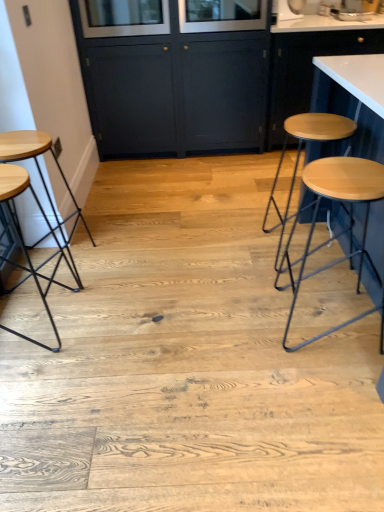
Question: Does clear glass window screen at upper center, the 2th window screen positioned from the left, have a lesser width compared to wooden seat at left, which is the 1th stool from left to right?

Choices:
 (A) yes
 (B) no

Answer: (B)

Question: Is clear glass window screen at upper center, the 2th window screen positioned from the left, at the left side of wooden seat at left, which is the 1th stool from left to right?

Choices:
 (A) no
 (B) yes

Answer: (A)

Question: Could wooden seat at left, placed as the second stool when sorted from right to left, be considered to be inside clear glass window screen at upper center, the 2th window screen positioned from the left?

Choices:
 (A) yes
 (B) no

Answer: (B)

Question: Can you confirm if clear glass window screen at upper center, the 1th window screen positioned from the right, is smaller than wooden seat at left, which is the 1th stool from left to right?

Choices:
 (A) yes
 (B) no

Answer: (A)

Question: From a real-world perspective, is clear glass window screen at upper center, the 2th window screen positioned from the left, under wooden seat at left, placed as the second stool when sorted from right to left?

Choices:
 (A) yes
 (B) no

Answer: (B)

Question: Considering the positions of wooden stool at right, which is the first stool from right to left, and clear glass window screen at upper center, the 1th window screen positioned from the right, in the image, is wooden stool at right, which is the first stool from right to left, taller or shorter than clear glass window screen at upper center, the 1th window screen positioned from the right,?

Choices:
 (A) short
 (B) tall

Answer: (B)

Question: Is wooden stool at right, which is the first stool from right to left, in front of or behind clear glass window screen at upper center, the 1th window screen positioned from the right, in the image?

Choices:
 (A) behind
 (B) front

Answer: (B)

Question: Is point (375, 165) closer or farther from the camera than point (253, 25)?

Choices:
 (A) closer
 (B) farther

Answer: (A)

Question: From a real-world perspective, is wooden stool at right, the second stool positioned from the left, above or below clear glass window screen at upper center, the 2th window screen positioned from the left?

Choices:
 (A) above
 (B) below

Answer: (B)

Question: Does point (294, 99) appear closer or farther from the camera than point (326, 11)?

Choices:
 (A) farther
 (B) closer

Answer: (B)

Question: From the image's perspective, is white glossy countertop at upper right, the first cabinetry in the right-to-left sequence, positioned above or below white glossy sink at upper right?

Choices:
 (A) above
 (B) below

Answer: (B)

Question: In the image, is white glossy countertop at upper right, the first cabinetry in the right-to-left sequence, on the left side or the right side of white glossy sink at upper right?

Choices:
 (A) left
 (B) right

Answer: (A)

Question: In terms of height, does white glossy countertop at upper right, the second cabinetry positioned from the left, look taller or shorter compared to white glossy sink at upper right?

Choices:
 (A) short
 (B) tall

Answer: (B)

Question: Considering the positions of dark blue wood cabinet at center, arranged as the 1th cabinetry when viewed from the left, and white glossy countertop at upper right, the first cabinetry in the right-to-left sequence, in the image, is dark blue wood cabinet at center, arranged as the 1th cabinetry when viewed from the left, bigger or smaller than white glossy countertop at upper right, the first cabinetry in the right-to-left sequence,?

Choices:
 (A) small
 (B) big

Answer: (B)

Question: In terms of width, does dark blue wood cabinet at center, arranged as the 1th cabinetry when viewed from the left, look wider or thinner when compared to white glossy countertop at upper right, the second cabinetry positioned from the left?

Choices:
 (A) thin
 (B) wide

Answer: (B)